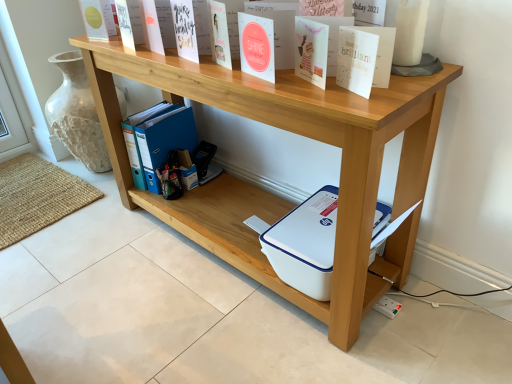
Question: From a real-world perspective, relative to natural wood shelf at upper center, which appears as the 1th shelf when viewed from the top, is white paper at upper right, which appears as the third paperback book when viewed from the top, vertically above or below?

Choices:
 (A) below
 (B) above

Answer: (B)

Question: Is white paper at upper right, which appears as the third paperback book when viewed from the top, bigger or smaller than natural wood shelf at upper center, which appears as the 1th shelf when viewed from the top?

Choices:
 (A) small
 (B) big

Answer: (A)

Question: Which is farther from the natural wood shelf at upper center, which appears as the 1th shelf when viewed from the top?

Choices:
 (A) blue plastic ring binder at lower center
 (B) matte blue notebook at upper center, placed as the 2th paperback book when sorted from bottom to top
 (C) white paper at upper right, the 1th paperback book from the right
 (D) matte yellow card at upper left, the 1th paperback book in the top-to-bottom sequence
 (E) white plastic printer at lower center, which appears as the 1th shelf when ordered from the bottom

Answer: (D)

Question: Considering the real-world distances, which object is farthest from the white plastic printer at lower center, positioned as the 2th shelf in top-to-bottom order?

Choices:
 (A) blue plastic ring binder at lower center
 (B) white paper at upper right, the 1th paperback book from the bottom
 (C) matte yellow card at upper left, which is counted as the third paperback book, starting from the bottom
 (D) matte blue notebook at upper center, marked as the 2th paperback book in a back-to-front arrangement
 (E) natural wood shelf at upper center, placed as the 2th shelf when sorted from bottom to top

Answer: (C)